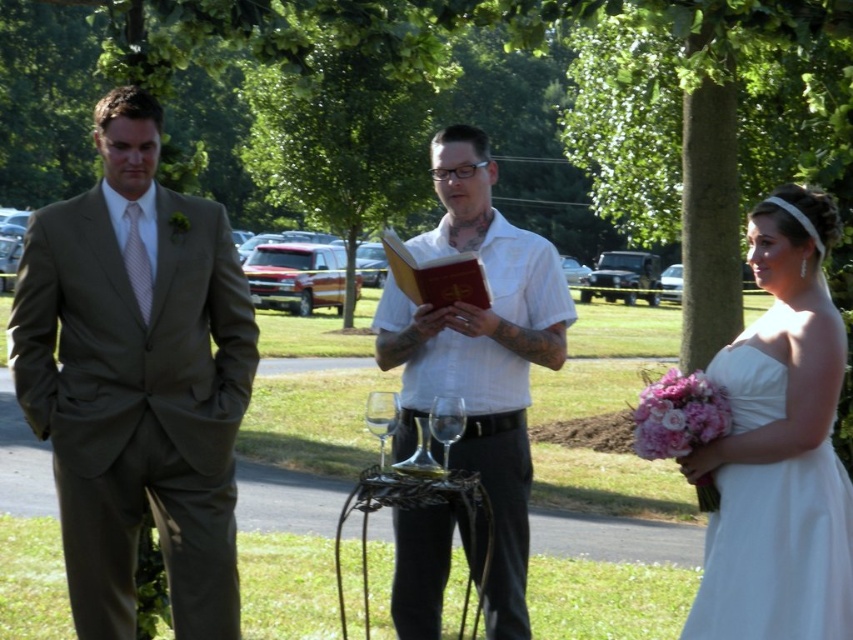
Question: Among these points, which one is farthest from the camera?

Choices:
 (A) (47, 360)
 (B) (752, 410)

Answer: (A)

Question: Which of the following is the farthest from the observer?

Choices:
 (A) clear glass wine glass at center
 (B) white matte shirt at center
 (C) white satin dress at right

Answer: (B)

Question: Is matte brown suit at left wider than clear glass wine glass at center?

Choices:
 (A) yes
 (B) no

Answer: (A)

Question: Which of the following is the farthest from the observer?

Choices:
 (A) (457, 401)
 (B) (502, 292)
 (C) (229, 234)

Answer: (B)

Question: Can you confirm if white satin dress at right is positioned below transparent glass wine glass at center?

Choices:
 (A) no
 (B) yes

Answer: (B)

Question: Is white matte shirt at center thinner than transparent glass wine glass at center?

Choices:
 (A) no
 (B) yes

Answer: (A)